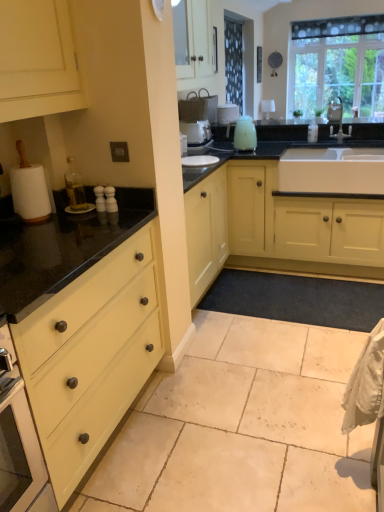
Describe the element at coordinates (338, 63) in the screenshot. I see `transparent glass window at upper right` at that location.

Measure the distance between point (330, 128) and camera.

The distance of point (330, 128) from camera is 3.31 meters.

Locate an element on the screen. matte yellow drawer at left is located at coordinates (90, 356).

Is transparent glass window at upper right not near beige tile floor at lower center?

Absolutely, transparent glass window at upper right is distant from beige tile floor at lower center.

Which is less distant, (x=361, y=61) or (x=250, y=336)?

The point (x=250, y=336) is in front.

Considering the sizes of transparent glass window at upper right and beige tile floor at lower center in the image, is transparent glass window at upper right wider or thinner than beige tile floor at lower center?

In the image, transparent glass window at upper right appears to be more narrow than beige tile floor at lower center.

Is transparent glass window at upper right aimed at beige tile floor at lower center?

Yes, transparent glass window at upper right is turned towards beige tile floor at lower center.

Considering the points (376, 70) and (340, 153), which point is behind, point (376, 70) or point (340, 153)?

The point (376, 70) is behind.

Would you say transparent glass window at upper right is to the left or to the right of white ceramic sink at center in the picture?

Based on their positions, transparent glass window at upper right is located to the right of white ceramic sink at center.

Is white ceramic sink at center at the back of transparent glass window at upper right?

transparent glass window at upper right does not have its back to white ceramic sink at center.

From a real-world perspective, is transparent glass window at upper right located beneath white ceramic sink at center?

Actually, transparent glass window at upper right is physically above white ceramic sink at center in the real world.

Which is correct: white ceramic sink at center is inside matte yellow drawer at left, or outside of it?

white ceramic sink at center is spatially situated outside matte yellow drawer at left.

Does white ceramic sink at center appear on the right side of matte yellow drawer at left?

Correct, you'll find white ceramic sink at center to the right of matte yellow drawer at left.

From a real-world perspective, which object stands above the other?

white ceramic sink at center, from a real-world perspective.

Could you tell me if satin nickel faucet at upper right is turned towards matte yellow drawer at left?

No, satin nickel faucet at upper right is not oriented towards matte yellow drawer at left.

Which is more to the left, satin nickel faucet at upper right or matte yellow drawer at left?

matte yellow drawer at left is more to the left.

From the image's perspective, is satin nickel faucet at upper right located above or below matte yellow drawer at left?

Clearly, from the image's perspective, satin nickel faucet at upper right is above matte yellow drawer at left.

Is satin nickel faucet at upper right in front of or behind matte yellow drawer at left in the image?

Visually, satin nickel faucet at upper right is located behind matte yellow drawer at left.

Based on their sizes in the image, would you say transparent glass window at upper right is bigger or smaller than matte yellow cabinet at center?

transparent glass window at upper right is smaller than matte yellow cabinet at center.

From a real-world perspective, is transparent glass window at upper right physically located above or below matte yellow cabinet at center?

transparent glass window at upper right is situated higher than matte yellow cabinet at center in the real world.

Does transparent glass window at upper right come behind matte yellow cabinet at center?

Yes, transparent glass window at upper right is further from the camera.

Is matte yellow drawer at left not close to satin nickel faucet at upper right?

matte yellow drawer at left is positioned a significant distance from satin nickel faucet at upper right.

Is matte yellow drawer at left wider than satin nickel faucet at upper right?

Yes.

Identify the location of tap lying on the right of matte yellow drawer at left. This screenshot has height=512, width=384. (337, 120).

Does matte yellow drawer at left appear on the right side of satin nickel faucet at upper right?

No.

What's the angular difference between matte yellow cabinet at center and transparent glass window at upper right's facing directions?

They differ by 1.31 degrees in their facing directions.

From the image's perspective, is matte yellow cabinet at center located above transparent glass window at upper right?

Incorrect, from the image's perspective, matte yellow cabinet at center is lower than transparent glass window at upper right.

Would you say matte yellow cabinet at center is a long distance from transparent glass window at upper right?

matte yellow cabinet at center is far away from transparent glass window at upper right.

Where is `window above the beige tile floor at lower center (from a real-world perspective)`? window above the beige tile floor at lower center (from a real-world perspective) is located at coordinates (338, 63).

At what (x,y) coordinates should I click in order to perform the action: click on sink that appears below the transparent glass window at upper right (from the image's perspective). Please return your answer as a coordinate pair (x, y). This screenshot has width=384, height=512. Looking at the image, I should click on (332, 170).

Based on their spatial positions, is satin nickel faucet at upper right or beige tile floor at lower center further from white ceramic sink at center?

satin nickel faucet at upper right.

Looking at the image, which one is located further to beige tile floor at lower center, satin nickel faucet at upper right or transparent glass window at upper right?

transparent glass window at upper right is further to beige tile floor at lower center.

When comparing their distances from satin nickel faucet at upper right, does transparent glass window at upper right or white ceramic sink at center seem further?

white ceramic sink at center.

From the image, which object appears to be farther from satin nickel faucet at upper right, transparent glass window at upper right or matte yellow drawer at left?

matte yellow drawer at left lies further to satin nickel faucet at upper right than the other object.

Which object lies nearer to the anchor point transparent glass window at upper right, matte yellow cabinet at center or white ceramic sink at center?

Based on the image, white ceramic sink at center appears to be nearer to transparent glass window at upper right.

Based on their spatial positions, is beige tile floor at lower center or transparent glass window at upper right further from white ceramic sink at center?

Among the two, transparent glass window at upper right is located further to white ceramic sink at center.

From the image, which object appears to be nearer to matte yellow cabinet at center, beige tile floor at lower center or transparent glass window at upper right?

beige tile floor at lower center lies closer to matte yellow cabinet at center than the other object.

When comparing their distances from matte yellow cabinet at center, does beige tile floor at lower center or satin nickel faucet at upper right seem further?

The object further to matte yellow cabinet at center is satin nickel faucet at upper right.

Locate an element on the screen. This screenshot has width=384, height=512. granite between matte yellow drawer at left and satin nickel faucet at upper right from front to back is located at coordinates (242, 426).

The image size is (384, 512). I want to click on granite located between matte yellow drawer at left and white ceramic sink at center in the depth direction, so click(242, 426).

Locate an element on the screen. The image size is (384, 512). tap located between beige tile floor at lower center and transparent glass window at upper right in the depth direction is located at coordinates (337, 120).

This screenshot has height=512, width=384. I want to click on cabinetry between matte yellow drawer at left and satin nickel faucet at upper right in the front-back direction, so click(277, 228).